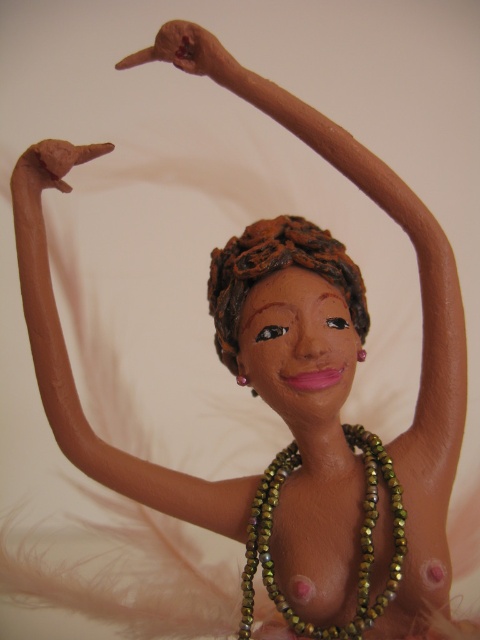
Based on the scene description, which object is taller between the green beaded necklace at center and the brown clay hair at center?

The green beaded necklace at center is much taller than the brown clay hair at center.

You are an art student analyzing the composition of the clay figurine. The image shows a woman with her arms raised. Where is the matte clay arm at upper center located in the image?

The matte clay arm at upper center is located at the point 2D coordinates of (71, 369).

You are an art student examining the clay figurine. You notice the green beaded necklace at center and the brown clay hair at center. Which object has a larger size?

The green beaded necklace at center is larger in size than the brown clay hair at center.